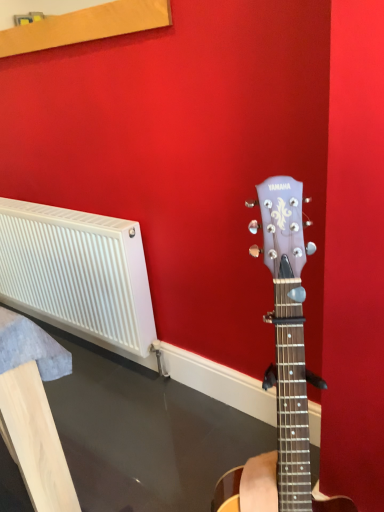
Question: Is white plastic radiator at left bigger than white plastic radiator at left?

Choices:
 (A) no
 (B) yes

Answer: (B)

Question: From a real-world perspective, is white plastic radiator at left located beneath white plastic radiator at left?

Choices:
 (A) yes
 (B) no

Answer: (A)

Question: Does white plastic radiator at left appear on the right side of white plastic radiator at left?

Choices:
 (A) yes
 (B) no

Answer: (A)

Question: Does white plastic radiator at left have a lesser width compared to white plastic radiator at left?

Choices:
 (A) yes
 (B) no

Answer: (A)

Question: Considering the relative positions of white plastic radiator at left and white plastic radiator at left in the image provided, is white plastic radiator at left in front of white plastic radiator at left?

Choices:
 (A) yes
 (B) no

Answer: (B)

Question: Is white plastic radiator at left oriented away from white plastic radiator at left?

Choices:
 (A) yes
 (B) no

Answer: (B)

Question: Is white plastic radiator at left at the left side of white plastic radiator at left?

Choices:
 (A) yes
 (B) no

Answer: (A)

Question: Can you confirm if white plastic radiator at left is bigger than white plastic radiator at left?

Choices:
 (A) no
 (B) yes

Answer: (A)

Question: Considering the relative sizes of white plastic radiator at left and white plastic radiator at left in the image provided, is white plastic radiator at left smaller than white plastic radiator at left?

Choices:
 (A) yes
 (B) no

Answer: (A)

Question: From a real-world perspective, is white plastic radiator at left located higher than white plastic radiator at left?

Choices:
 (A) no
 (B) yes

Answer: (B)

Question: From the image's perspective, is white plastic radiator at left located beneath white plastic radiator at left?

Choices:
 (A) yes
 (B) no

Answer: (A)

Question: Is white plastic radiator at left closer to the viewer compared to white plastic radiator at left?

Choices:
 (A) no
 (B) yes

Answer: (B)

Question: From a real-world perspective, is white plastic radiator at left above or below white plastic radiator at left?

Choices:
 (A) below
 (B) above

Answer: (B)